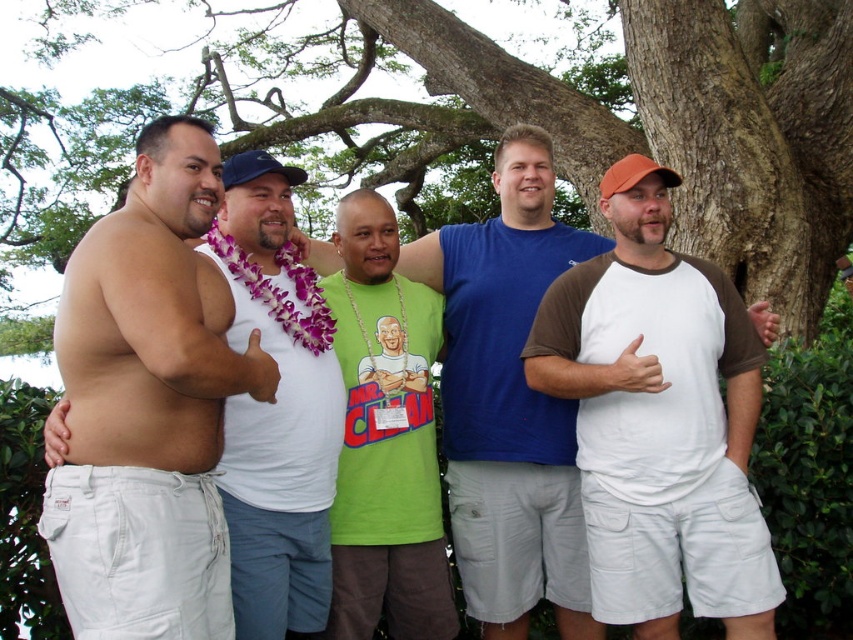
Question: Does brown cotton t-shirt at center appear on the left side of white fabric tank top at center?

Choices:
 (A) yes
 (B) no

Answer: (B)

Question: Which point appears farthest from the camera in this image?

Choices:
 (A) (228, 384)
 (B) (399, 323)

Answer: (B)

Question: Is brown cotton t-shirt at center above skinny white skin at left?

Choices:
 (A) no
 (B) yes

Answer: (A)

Question: Which of the following is the closest to the observer?

Choices:
 (A) (309, 298)
 (B) (405, 388)
 (C) (381, 502)
 (D) (648, 212)

Answer: (D)

Question: Is skinny white pants at left above white fabric tank top at center?

Choices:
 (A) yes
 (B) no

Answer: (A)

Question: Considering the real-world distances, which object is farthest from the white fabric tank top at center?

Choices:
 (A) skinny white skin at left
 (B) green fabric shirt at center

Answer: (A)